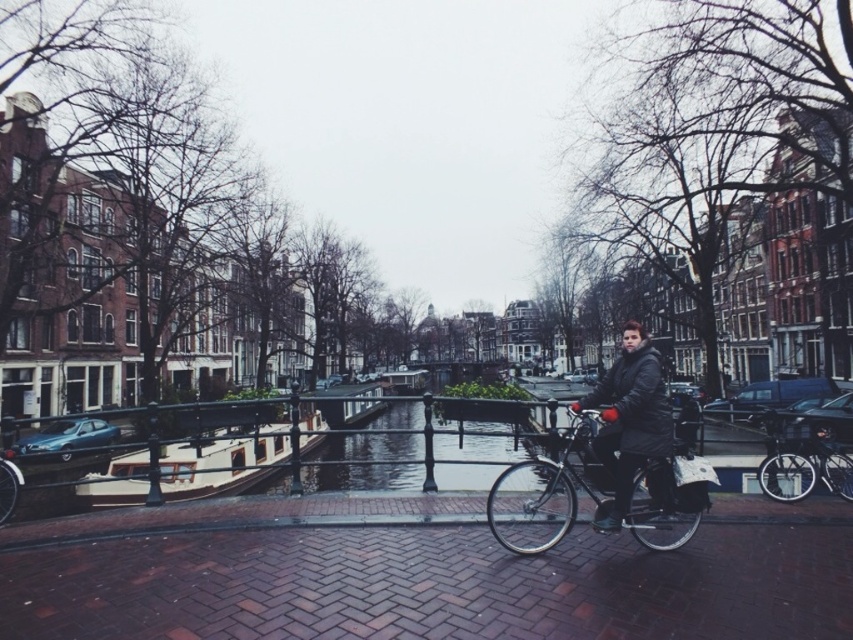
Question: Which point is farther to the camera?

Choices:
 (A) (606, 522)
 (B) (654, 467)
 (C) (793, 486)

Answer: (C)

Question: Does shiny black bicycle at center have a greater width compared to clear glass waterway at center?

Choices:
 (A) yes
 (B) no

Answer: (B)

Question: Is wooden polished boat at center-left to the right of shiny metallic bicycle at center from the viewer's perspective?

Choices:
 (A) no
 (B) yes

Answer: (A)

Question: From the image, what is the correct spatial relationship of shiny black bicycle at center in relation to black matte jacket at center?

Choices:
 (A) right
 (B) left

Answer: (B)

Question: Based on their relative distances, which object is nearer to the shiny black bicycle at center?

Choices:
 (A) black matte jacket at center
 (B) clear glass waterway at center
 (C) shiny metallic bicycle at center
 (D) wooden polished boat at center-left

Answer: (A)

Question: Among these points, which one is nearest to the camera?

Choices:
 (A) pos(434,476)
 (B) pos(828,467)

Answer: (B)